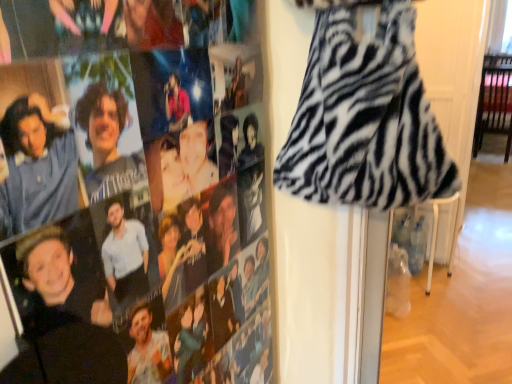
Question: Is zebra print dress at right oriented away from zebra print fur dress at right?

Choices:
 (A) no
 (B) yes

Answer: (A)

Question: From a real-world perspective, is zebra print dress at right physically above zebra print fur dress at right?

Choices:
 (A) yes
 (B) no

Answer: (B)

Question: Can you confirm if zebra print dress at right is thinner than zebra print fur dress at right?

Choices:
 (A) yes
 (B) no

Answer: (A)

Question: Considering the relative positions of zebra print dress at right and zebra print fur dress at right in the image provided, is zebra print dress at right behind zebra print fur dress at right?

Choices:
 (A) no
 (B) yes

Answer: (A)

Question: Would you consider zebra print dress at right to be distant from zebra print fur dress at right?

Choices:
 (A) no
 (B) yes

Answer: (A)

Question: Is the position of zebra print dress at right less distant than that of zebra print fur dress at right?

Choices:
 (A) yes
 (B) no

Answer: (A)

Question: Is zebra print fur dress at right looking in the opposite direction of zebra print dress at right?

Choices:
 (A) no
 (B) yes

Answer: (A)

Question: Is zebra print fur dress at right positioned far away from zebra print dress at right?

Choices:
 (A) yes
 (B) no

Answer: (B)

Question: From the image's perspective, is zebra print fur dress at right over zebra print dress at right?

Choices:
 (A) yes
 (B) no

Answer: (A)

Question: From the image's perspective, would you say zebra print fur dress at right is shown under zebra print dress at right?

Choices:
 (A) no
 (B) yes

Answer: (A)

Question: Does zebra print fur dress at right have a lesser height compared to zebra print dress at right?

Choices:
 (A) yes
 (B) no

Answer: (A)

Question: Does zebra print fur dress at right come behind zebra print dress at right?

Choices:
 (A) yes
 (B) no

Answer: (A)

Question: Is zebra print fur dress at right taller or shorter than zebra print dress at right?

Choices:
 (A) tall
 (B) short

Answer: (B)